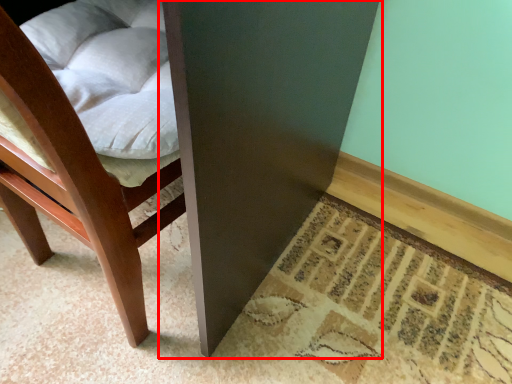
Question: From the image's perspective, where is table (annotated by the red box) located in relation to chair in the image?

Choices:
 (A) above
 (B) below

Answer: (A)